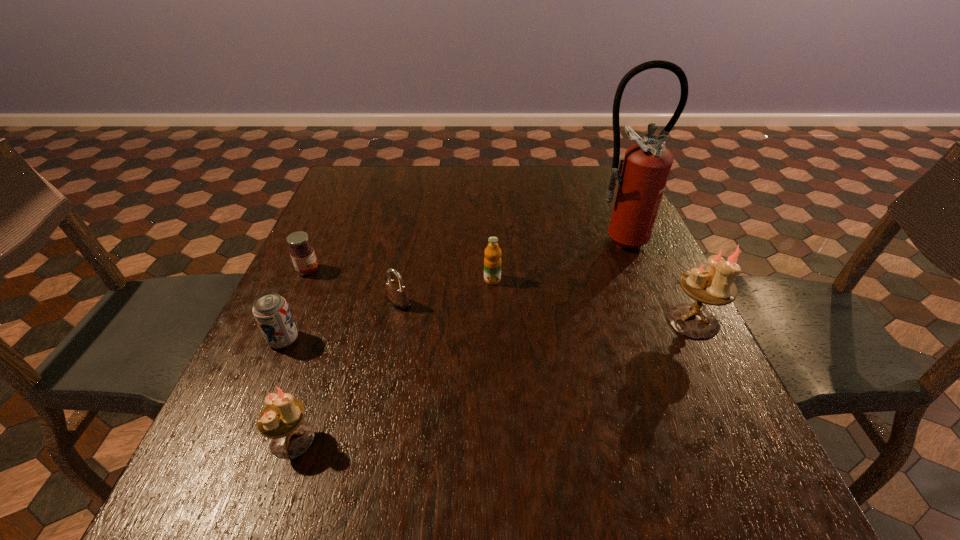
Where is `beer can that is positioned at the left edge`? beer can that is positioned at the left edge is located at coordinates (271, 311).

Find the location of a particular element. This screenshot has width=960, height=540. candle holder present at the right edge is located at coordinates (714, 285).

The width and height of the screenshot is (960, 540). Find the location of `fire extinguisher at the right edge`. fire extinguisher at the right edge is located at coordinates (643, 172).

Locate an element on the screen. This screenshot has width=960, height=540. object present at the near left corner is located at coordinates (281, 420).

Locate an element on the screen. This screenshot has width=960, height=540. free space at the far edge is located at coordinates point(389,192).

You are a GUI agent. You are given a task and a screenshot of the screen. Output one action in this format:
    pyautogui.click(x=<x>, y=<y>)
    Task: Click on the free spot at the left edge of the desktop
    The width and height of the screenshot is (960, 540).
    Given the screenshot: What is the action you would take?
    pyautogui.click(x=291, y=370)

In order to click on vacant region at the right edge of the desktop in this screenshot , I will do `click(627, 252)`.

Image resolution: width=960 pixels, height=540 pixels. Identify the location of vacant region at the far left corner. (388, 171).

Identify the location of vacant position at the near left corner of the desktop. The width and height of the screenshot is (960, 540). (232, 432).

The image size is (960, 540). In the image, there is a desktop. In order to click on blank space at the far right corner in this screenshot , I will do `click(587, 173)`.